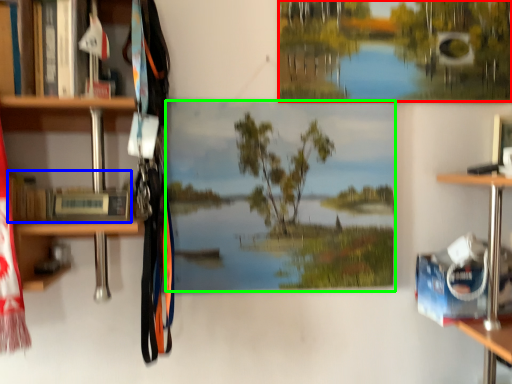
Question: Which object is the farthest from tree (highlighted by a red box)? Choose among these: book (highlighted by a blue box) or mural (highlighted by a green box).

Choices:
 (A) book
 (B) mural

Answer: (A)